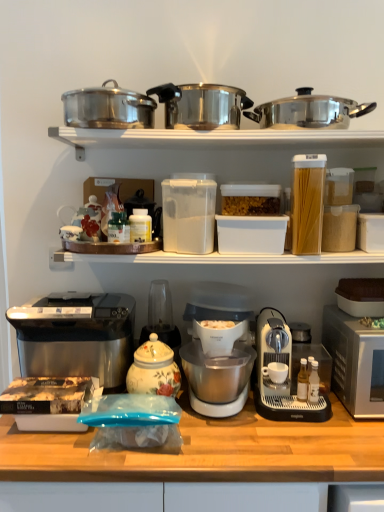
The image size is (384, 512). What are the coordinates of `free space above clear plastic bag at center (from a real-world perspective)` in the screenshot? It's located at (254, 424).